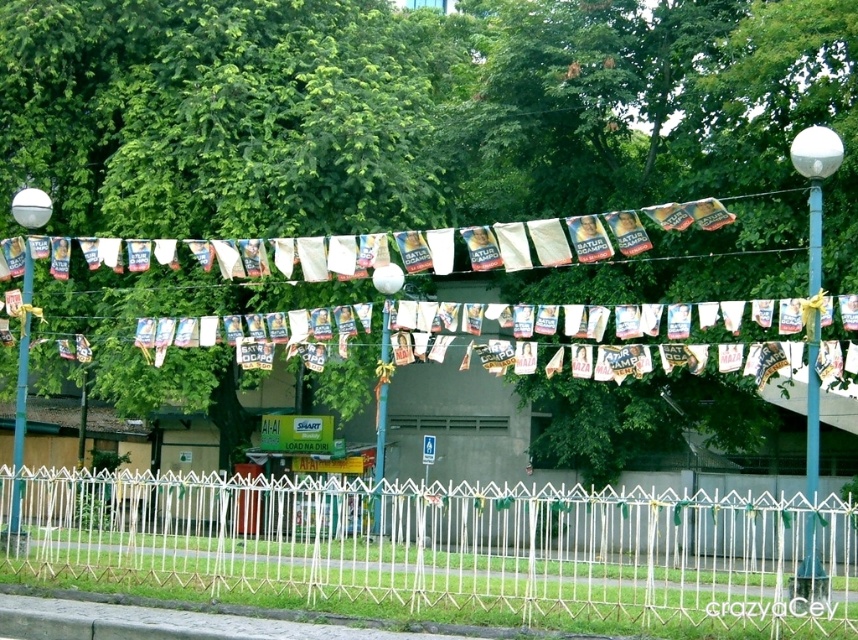
Question: Based on their relative distances, which object is nearer to the white bamboo fence at lower center?

Choices:
 (A) metallic pole at left
 (B) blue metallic pole at center
 (C) blue metallic pole at right

Answer: (B)

Question: Which object is the closest to the blue metallic pole at right?

Choices:
 (A) white bamboo fence at lower center
 (B) blue metallic pole at center

Answer: (A)

Question: Observing the image, what is the correct spatial positioning of white bamboo fence at lower center in reference to blue metallic pole at center?

Choices:
 (A) left
 (B) right

Answer: (B)

Question: Can you confirm if blue metallic pole at right is bigger than blue metallic pole at center?

Choices:
 (A) no
 (B) yes

Answer: (A)

Question: Which is farther from the blue metallic pole at center?

Choices:
 (A) blue metallic pole at right
 (B) metallic pole at left

Answer: (A)

Question: Where is blue metallic pole at right located in relation to blue metallic pole at center in the image?

Choices:
 (A) left
 (B) right

Answer: (B)